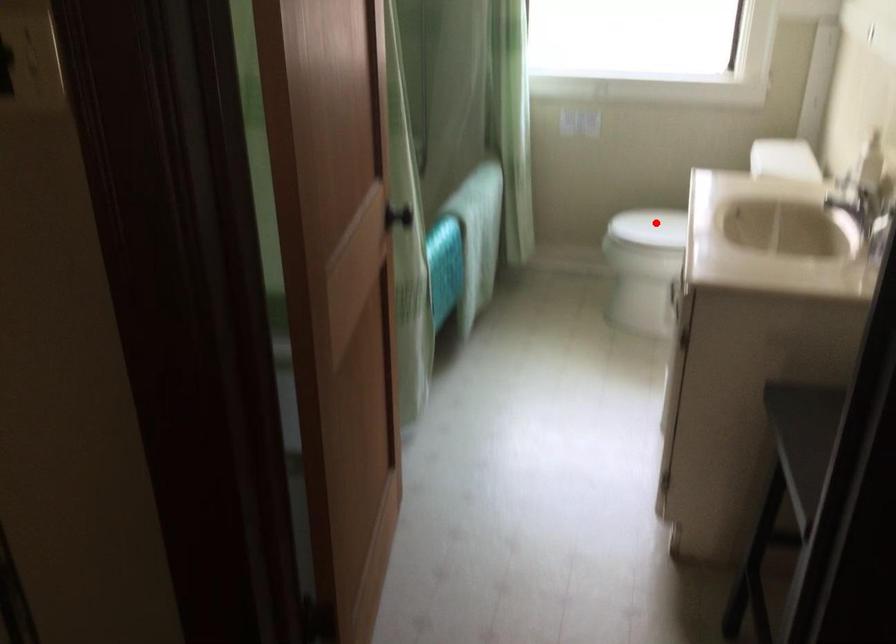
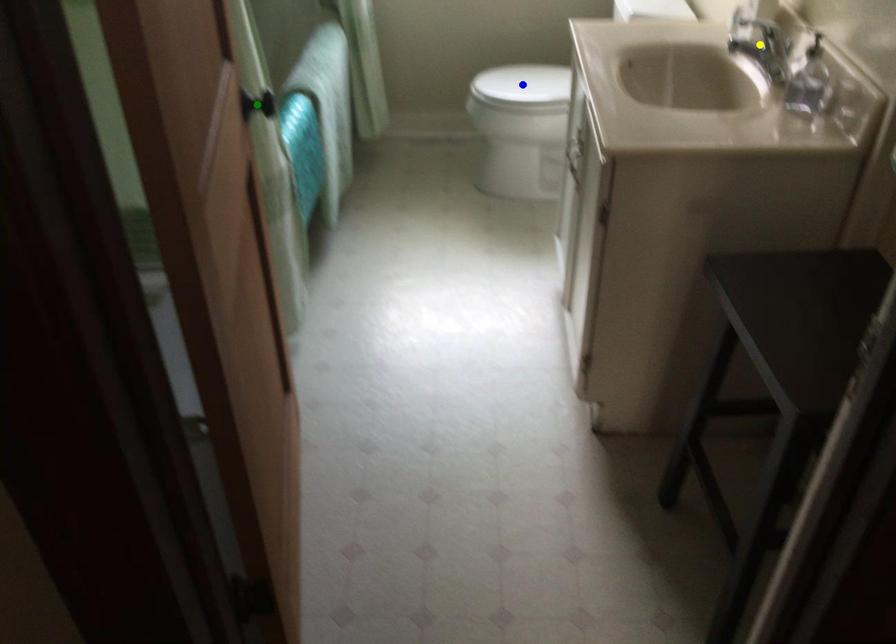
Question: I am providing you with two images of the same scene from different viewpoints. A red point is marked on the first image. You are given multiple points on the second image. Which point in image 2 is actually the same real-world point as the red point in image 1?

Choices:
 (A) yellow point
 (B) blue point
 (C) green point

Answer: (B)